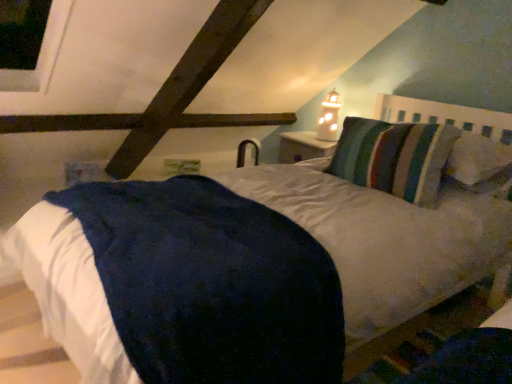
This screenshot has height=384, width=512. What do you see at coordinates (471, 355) in the screenshot? I see `velvety blue blanket at lower right` at bounding box center [471, 355].

What do you see at coordinates (329, 117) in the screenshot?
I see `white frosted glass at upper center` at bounding box center [329, 117].

I want to click on striped fabric pillow at upper right, so click(x=394, y=157).

The image size is (512, 384). I want to click on dark blue plush mattress at center, so click(x=210, y=283).

Looking at their sizes, would you say dark blue plush mattress at center is wider or thinner than striped fabric pillow at upper right?

In the image, dark blue plush mattress at center appears to be wider than striped fabric pillow at upper right.

In the scene shown: Is dark blue plush mattress at center far away from striped fabric pillow at upper right?

No, dark blue plush mattress at center is not far away from striped fabric pillow at upper right.

Is striped fabric pillow at upper right at the back of dark blue plush mattress at center?

No, dark blue plush mattress at center is not facing the opposite direction of striped fabric pillow at upper right.

In the scene shown: Between velvety blue blanket at lower right and striped fabric pillow at upper right, which one has smaller size?

Smaller between the two is velvety blue blanket at lower right.

Is velvety blue blanket at lower right directly adjacent to striped fabric pillow at upper right?

No.

Which of these two, velvety blue blanket at lower right or striped fabric pillow at upper right, stands shorter?

velvety blue blanket at lower right is shorter.

Which point is more distant from viewer, [421,367] or [452,131]?

The point [452,131] is more distant.

In the scene shown: Is striped fabric pillow at upper right positioned beyond the bounds of white frosted glass at upper center?

Yes, striped fabric pillow at upper right is not within white frosted glass at upper center.

From a real-world perspective, is striped fabric pillow at upper right located higher than white frosted glass at upper center?

No, from a real-world perspective, striped fabric pillow at upper right is not above white frosted glass at upper center.

Is striped fabric pillow at upper right oriented away from white frosted glass at upper center?

No, white frosted glass at upper center is not at the back of striped fabric pillow at upper right.

From their relative heights in the image, would you say velvety blue blanket at lower right is taller or shorter than dark blue plush mattress at center?

velvety blue blanket at lower right is shorter than dark blue plush mattress at center.

Which is nearer, (439, 383) or (295, 310)?

Point (439, 383) is closer to the camera than point (295, 310).

Which of these two, velvety blue blanket at lower right or dark blue plush mattress at center, is bigger?

dark blue plush mattress at center.

Are white frosted glass at upper center and striped fabric pillow at upper right far apart?

That's not correct — white frosted glass at upper center is a little close to striped fabric pillow at upper right.

From a real-world perspective, which object stands above the other?

white frosted glass at upper center.

Between white frosted glass at upper center and striped fabric pillow at upper right, which one has smaller size?

white frosted glass at upper center is smaller.

From the image's perspective, is white frosted glass at upper center above striped fabric pillow at upper right?

Indeed, from the image's perspective, white frosted glass at upper center is shown above striped fabric pillow at upper right.

Is the surface of white frosted glass at upper center in direct contact with velvety blue blanket at lower right?

There is a gap between white frosted glass at upper center and velvety blue blanket at lower right.

In the image, is white frosted glass at upper center on the left side or the right side of velvety blue blanket at lower right?

From the image, it's evident that white frosted glass at upper center is to the left of velvety blue blanket at lower right.

Considering the sizes of objects striped fabric pillow at upper right and velvety blue blanket at lower right in the image provided, who is thinner, striped fabric pillow at upper right or velvety blue blanket at lower right?

velvety blue blanket at lower right is thinner.

From the picture: Is striped fabric pillow at upper right located outside velvety blue blanket at lower right?

Yes, striped fabric pillow at upper right is outside of velvety blue blanket at lower right.

From a real-world perspective, is striped fabric pillow at upper right physically located above or below velvety blue blanket at lower right?

In terms of real-world spatial position, striped fabric pillow at upper right is above velvety blue blanket at lower right.

Is striped fabric pillow at upper right oriented away from velvety blue blanket at lower right?

No, striped fabric pillow at upper right is not facing the opposite direction of velvety blue blanket at lower right.

This screenshot has width=512, height=384. Find the location of `mattress in front of the striped fabric pillow at upper right`. mattress in front of the striped fabric pillow at upper right is located at coordinates (210, 283).

Locate an element on the screen. Image resolution: width=512 pixels, height=384 pixels. dark below the striped fabric pillow at upper right (from a real-world perspective) is located at coordinates (471, 355).

Looking at the image, which one is located further to striped fabric pillow at upper right, dark blue plush mattress at center or white frosted glass at upper center?

The object further to striped fabric pillow at upper right is dark blue plush mattress at center.

Based on their spatial positions, is dark blue plush mattress at center or striped fabric pillow at upper right further from velvety blue blanket at lower right?

striped fabric pillow at upper right.

Looking at the image, which one is located closer to velvety blue blanket at lower right, striped fabric pillow at upper right or white frosted glass at upper center?

striped fabric pillow at upper right lies closer to velvety blue blanket at lower right than the other object.

Looking at the image, which one is located further to white frosted glass at upper center, striped fabric pillow at upper right or velvety blue blanket at lower right?

The object further to white frosted glass at upper center is velvety blue blanket at lower right.

Based on their spatial positions, is dark blue plush mattress at center or white frosted glass at upper center closer to velvety blue blanket at lower right?

dark blue plush mattress at center is positioned closer to the anchor velvety blue blanket at lower right.

Estimate the real-world distances between objects in this image. Which object is further from dark blue plush mattress at center, striped fabric pillow at upper right or white frosted glass at upper center?

The object further to dark blue plush mattress at center is white frosted glass at upper center.

Estimate the real-world distances between objects in this image. Which object is closer to dark blue plush mattress at center, white frosted glass at upper center or striped fabric pillow at upper right?

striped fabric pillow at upper right is positioned closer to the anchor dark blue plush mattress at center.

Estimate the real-world distances between objects in this image. Which object is closer to white frosted glass at upper center, dark blue plush mattress at center or velvety blue blanket at lower right?

Among the two, dark blue plush mattress at center is located nearer to white frosted glass at upper center.

Where is `pillow between dark blue plush mattress at center and white frosted glass at upper center from front to back`? pillow between dark blue plush mattress at center and white frosted glass at upper center from front to back is located at coordinates (394, 157).

You are a GUI agent. You are given a task and a screenshot of the screen. Output one action in this format:
    pyautogui.click(x=<x>, y=<y>)
    Task: Click on the pillow located between dark blue plush mattress at center and velvety blue blanket at lower right in the left-right direction
    This screenshot has height=384, width=512.
    Given the screenshot: What is the action you would take?
    pyautogui.click(x=394, y=157)

Where is `dark between dark blue plush mattress at center and white frosted glass at upper center from front to back`? This screenshot has height=384, width=512. dark between dark blue plush mattress at center and white frosted glass at upper center from front to back is located at coordinates (471, 355).

Where is `pillow between white frosted glass at upper center and velvety blue blanket at lower right in the up-down direction`? Image resolution: width=512 pixels, height=384 pixels. pillow between white frosted glass at upper center and velvety blue blanket at lower right in the up-down direction is located at coordinates (394, 157).